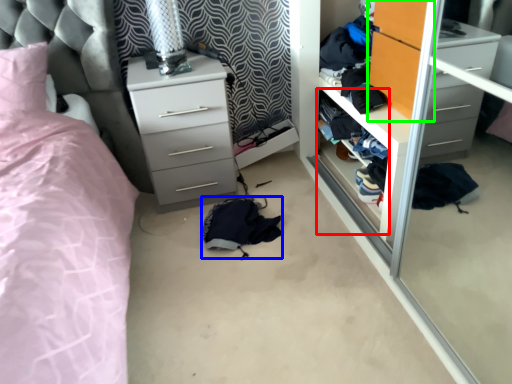
Question: Based on their relative distances, which object is farther from shelf (highlighted by a red box)? Choose from clothing (highlighted by a blue box) and armoire (highlighted by a green box).

Choices:
 (A) clothing
 (B) armoire

Answer: (A)